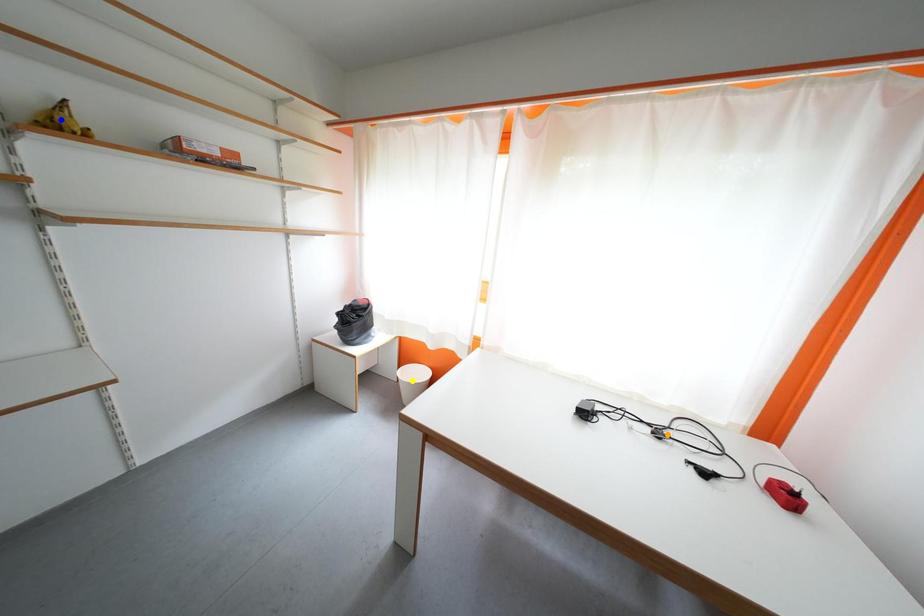
Order these from nearest to farthest:
blue point, yellow point, orange point

blue point, orange point, yellow point